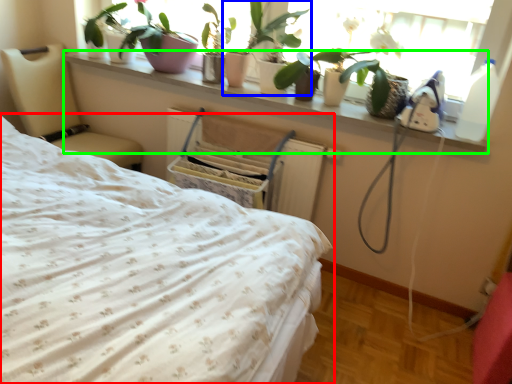
Question: Which is farther away from bed (highlighted by a red box)? houseplant (highlighted by a blue box) or ledge (highlighted by a green box)?

Choices:
 (A) houseplant
 (B) ledge

Answer: (A)